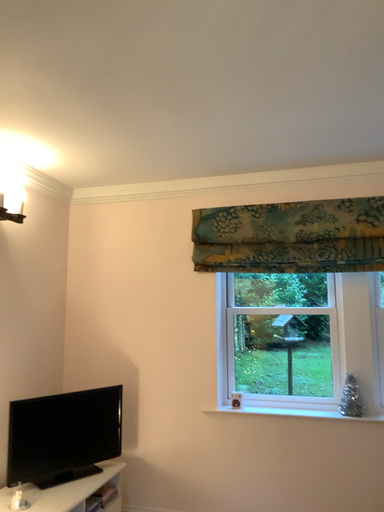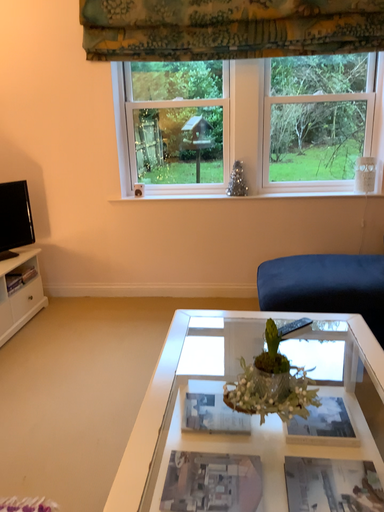
Question: How did the camera likely rotate when shooting the video?

Choices:
 (A) rotated left
 (B) rotated right

Answer: (B)